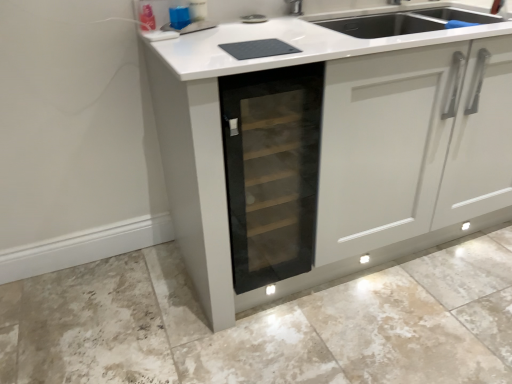
At what (x,y) coordinates should I click in order to perform the action: click on free space above matte gray granite at lower center (from a real-world perspective). Please return your answer as a coordinate pair (x, y). The width and height of the screenshot is (512, 384). Looking at the image, I should click on (305, 316).